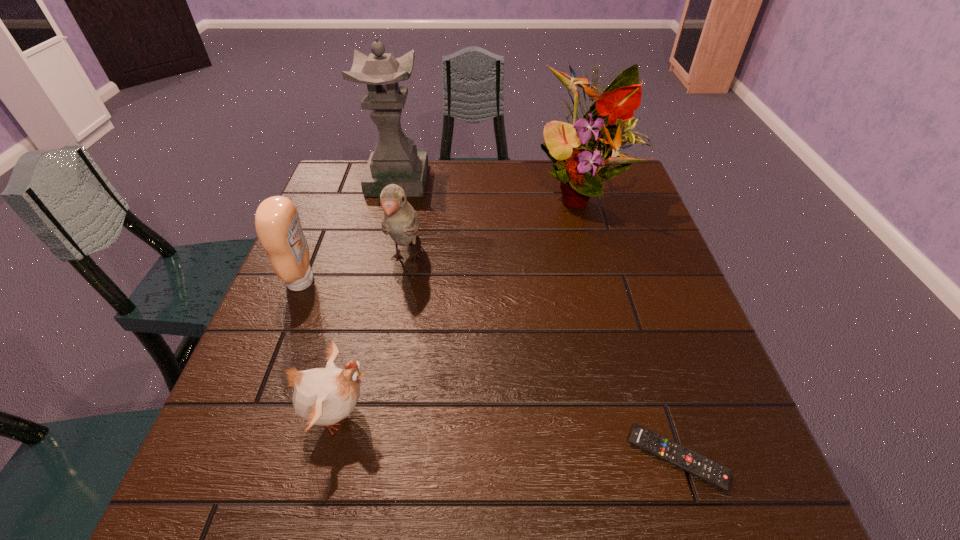
What are the coordinates of `vacant space located 0.100m on the label of the condiment` in the screenshot? It's located at (359, 281).

The height and width of the screenshot is (540, 960). Find the location of `vacant space located at the beak of the shorter bird`. vacant space located at the beak of the shorter bird is located at coordinates (533, 414).

This screenshot has width=960, height=540. Identify the location of vacant space located 0.050m on the left of the shortest object. (601, 457).

Find the location of a particular element. The width and height of the screenshot is (960, 540). sculpture that is at the far edge is located at coordinates (395, 160).

The height and width of the screenshot is (540, 960). Find the location of `bouquet that is at the far edge`. bouquet that is at the far edge is located at coordinates (582, 159).

At what (x,y) coordinates should I click in order to perform the action: click on bird at the near edge. Please return your answer as a coordinate pair (x, y). The height and width of the screenshot is (540, 960). Looking at the image, I should click on (322, 396).

In order to click on remote control present at the near edge in this screenshot , I will do `click(688, 460)`.

This screenshot has height=540, width=960. In order to click on sculpture at the left edge in this screenshot , I will do pyautogui.click(x=395, y=160).

Where is `condiment located in the left edge section of the desktop`? condiment located in the left edge section of the desktop is located at coordinates (277, 223).

Find the location of `bird at the left edge`. bird at the left edge is located at coordinates (322, 396).